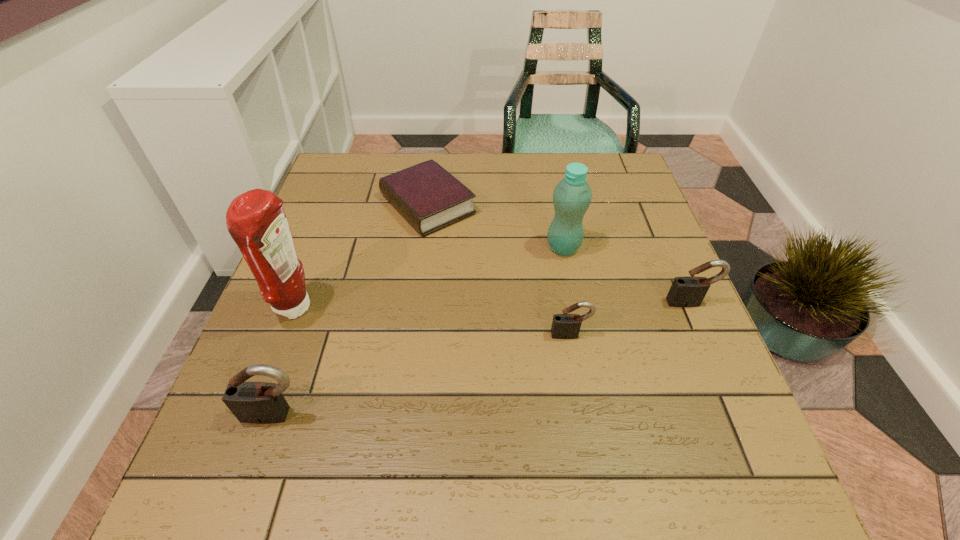
Where is `the nearest padlock`? The height and width of the screenshot is (540, 960). the nearest padlock is located at coordinates pyautogui.click(x=251, y=402).

You are a GUI agent. You are given a task and a screenshot of the screen. Output one action in this format:
    pyautogui.click(x=<x>, y=<y>)
    Task: Click on the leftmost padlock
    
    Given the screenshot: What is the action you would take?
    pyautogui.click(x=251, y=402)

Identify the location of the fifth tallest object. (564, 326).

Find the location of a particular element. The height and width of the screenshot is (540, 960). the second padlock from right to left is located at coordinates [564, 326].

Find the location of a particular element. The width and height of the screenshot is (960, 540). the farthest padlock is located at coordinates (689, 291).

Where is `the rightmost object`? the rightmost object is located at coordinates (689, 291).

At what (x,y) coordinates should I click in order to perform the action: click on Bible. Please return your answer as a coordinate pair (x, y). This screenshot has height=540, width=960. Looking at the image, I should click on (430, 198).

The width and height of the screenshot is (960, 540). What are the coordinates of `the fourth object from right to left` in the screenshot? It's located at (430, 198).

This screenshot has width=960, height=540. I want to click on water bottle, so click(x=572, y=196).

Where is `the tallest object`? the tallest object is located at coordinates (256, 220).